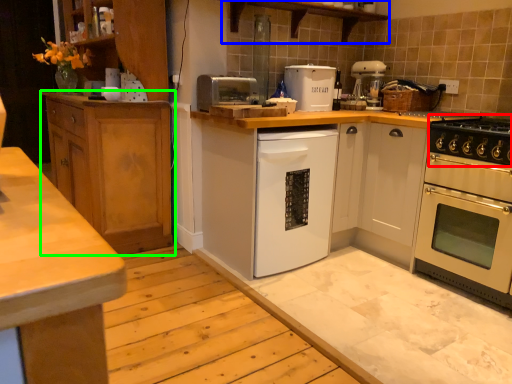
Question: Which object is positioned closest to gas stove (highlighted by a red box)? Select from shelf (highlighted by a blue box) and cabinetry (highlighted by a green box).

Choices:
 (A) shelf
 (B) cabinetry

Answer: (A)